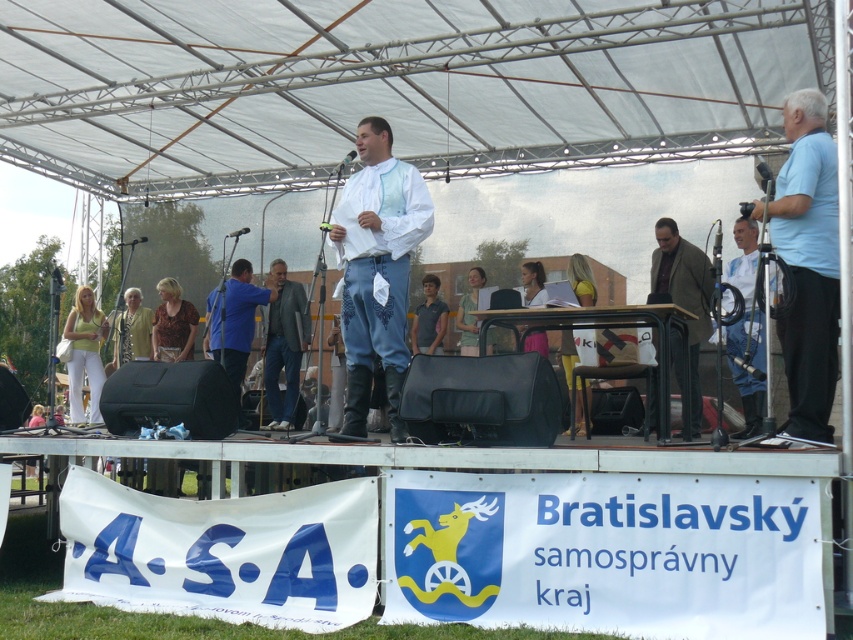
Is light blue shirt at right taller than white cotton shirt at center?

No, light blue shirt at right is not taller than white cotton shirt at center.

This screenshot has height=640, width=853. Describe the element at coordinates (807, 262) in the screenshot. I see `light blue shirt at right` at that location.

Identify the location of light blue shirt at right. (807, 262).

Image resolution: width=853 pixels, height=640 pixels. What are the coordinates of `pink fabric shirt at center` in the screenshot? It's located at (532, 284).

Is pink fabric shirt at center shorter than metallic silver microphone at center?

Indeed, pink fabric shirt at center has a lesser height compared to metallic silver microphone at center.

Does point (543, 301) lie behind point (341, 164)?

Yes, it is.

Where is `pink fabric shirt at center`? The height and width of the screenshot is (640, 853). pink fabric shirt at center is located at coordinates (532, 284).

Is point (264, 332) closer to camera compared to point (236, 230)?

No, (264, 332) is behind (236, 230).

What do you see at coordinates (283, 344) in the screenshot? The width and height of the screenshot is (853, 640). I see `denim jacket at center` at bounding box center [283, 344].

Is point (287, 348) positioned after point (247, 230)?

That is True.

This screenshot has width=853, height=640. I want to click on denim jacket at center, so click(283, 344).